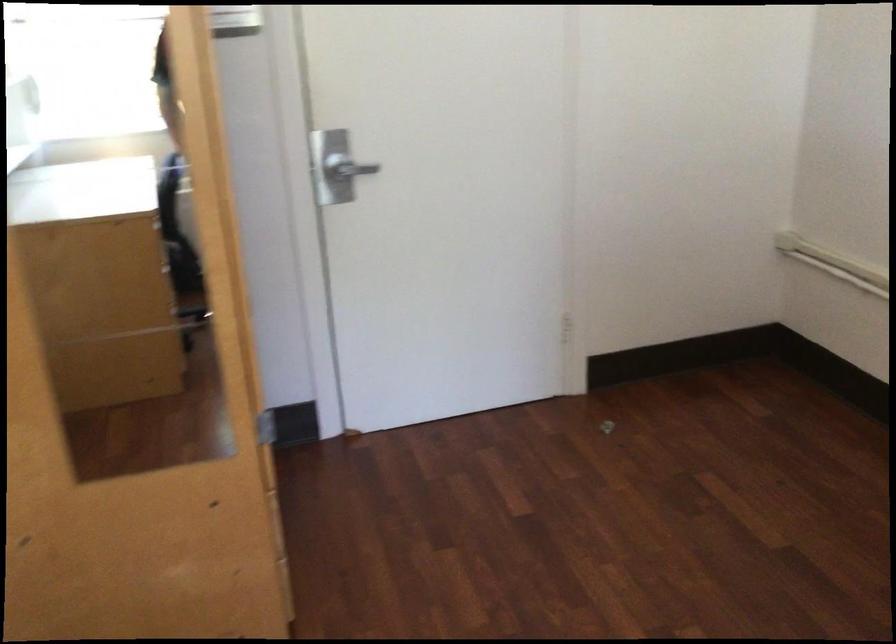
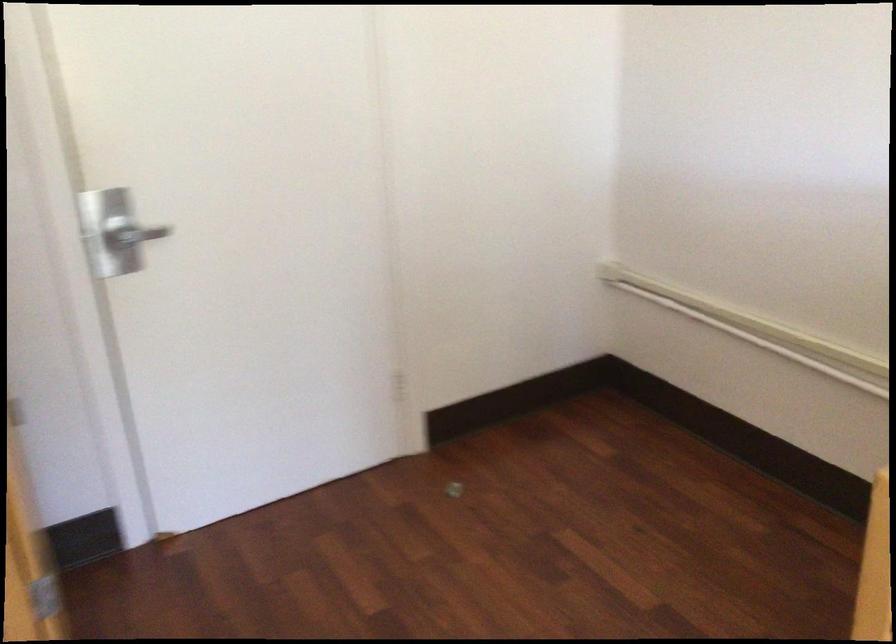
The point at (607, 426) is marked in the first image. Where is the corresponding point in the second image?

(453, 489)